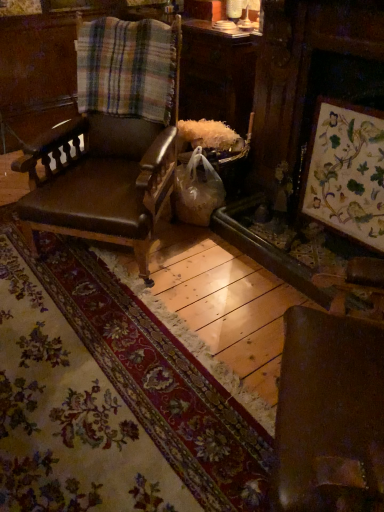
The width and height of the screenshot is (384, 512). What are the coordinates of `free space to the left of wooden floral artwork at right` in the screenshot? It's located at (256, 284).